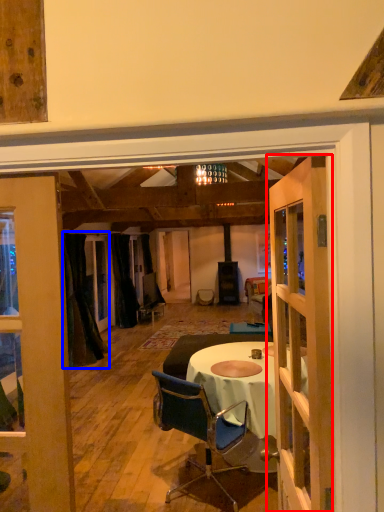
Question: Among these objects, which one is nearest to the camera, door (highlighted by a red box) or curtain (highlighted by a blue box)?

Choices:
 (A) door
 (B) curtain

Answer: (A)